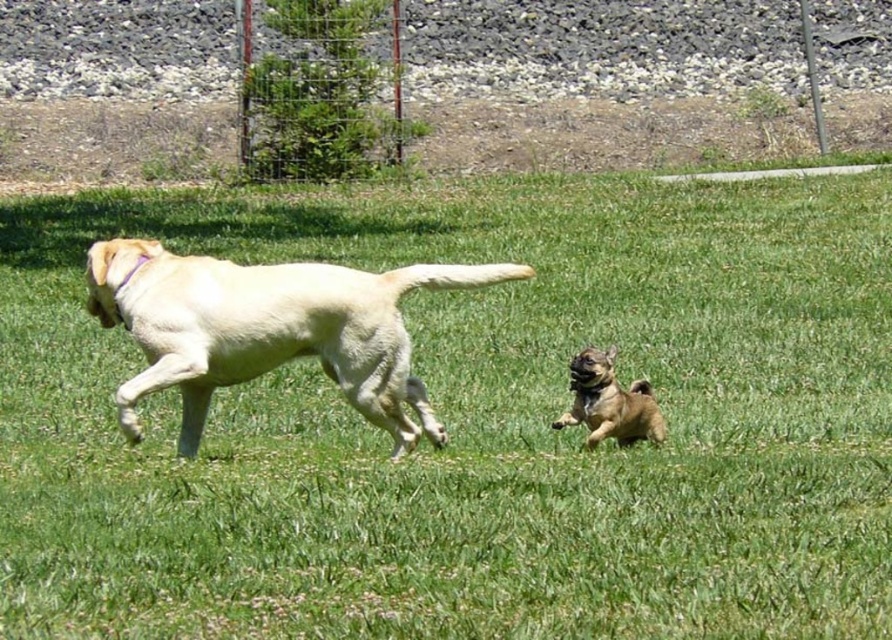
Is light yellow fur at center wider than brown furry dog at center?

Indeed, light yellow fur at center has a greater width compared to brown furry dog at center.

Is light yellow fur at center further to camera compared to brown furry dog at center?

No, it is in front of brown furry dog at center.

This screenshot has width=892, height=640. I want to click on light yellow fur at center, so click(268, 328).

Does green grass at center appear on the right side of light yellow fur at center?

Yes, green grass at center is to the right of light yellow fur at center.

Is point (116, 513) closer to camera compared to point (197, 369)?

That is True.

At what (x,y) coordinates should I click in order to perform the action: click on green grass at center. Please return your answer as a coordinate pair (x, y). This screenshot has width=892, height=640. Looking at the image, I should click on (472, 424).

Is green grass at center bigger than brown furry dog at center?

Yes.

Locate an element on the screen. green grass at center is located at coordinates point(472,424).